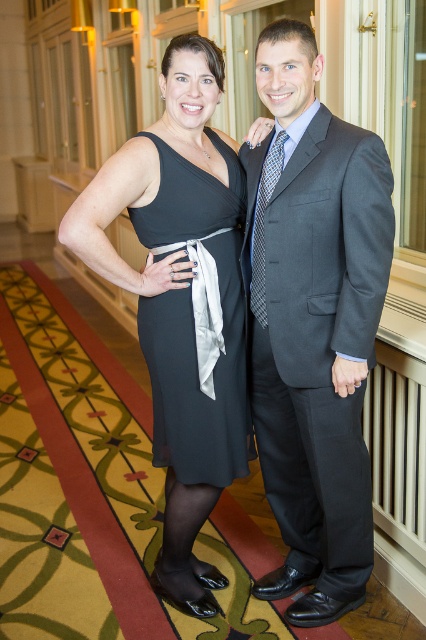
Is point (207, 170) closer to camera compared to point (259, 285)?

That is True.

This screenshot has height=640, width=426. Describe the element at coordinates (181, 300) in the screenshot. I see `matte black dress at center` at that location.

This screenshot has height=640, width=426. Identify the location of matte black dress at center. (181, 300).

Where is `matte black dress at center`? matte black dress at center is located at coordinates (181, 300).

Can you confirm if dark gray suit at center is smaller than black chiffon dress at center?

No.

Is dark gray suit at center positioned at the back of black chiffon dress at center?

That is False.

Between point (325, 189) and point (178, 426), which one is positioned in front?

Point (325, 189) is in front.

Identify the location of dark gray suit at center. (313, 324).

Is point (140, 282) less distant than point (146, 321)?

Yes, point (140, 282) is in front of point (146, 321).

Can you confirm if matte black dress at center is smaller than black chiffon dress at center?

No.

Where is `matte black dress at center`? matte black dress at center is located at coordinates (181, 300).